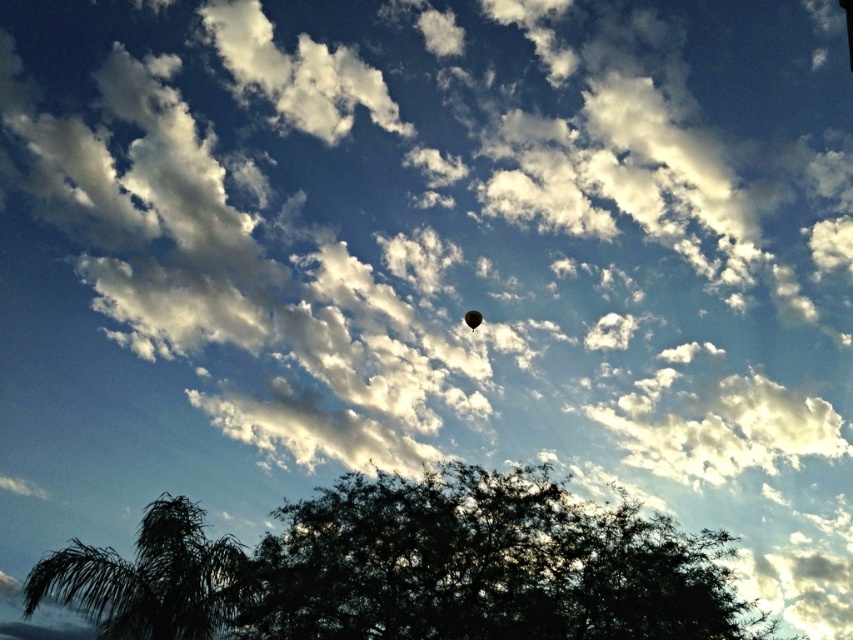
Question: Which of the following is the farthest from the observer?

Choices:
 (A) (473, 323)
 (B) (234, 554)

Answer: (A)

Question: Does dark green leafy tree at center have a lesser width compared to green leafy tree at lower left?

Choices:
 (A) yes
 (B) no

Answer: (B)

Question: Among these points, which one is nearest to the camera?

Choices:
 (A) (144, 540)
 (B) (595, 604)
 (C) (471, 326)

Answer: (B)

Question: Does green leafy tree at lower left have a larger size compared to green rubber balloon at upper center?

Choices:
 (A) yes
 (B) no

Answer: (A)

Question: Among these objects, which one is farthest from the camera?

Choices:
 (A) green rubber balloon at upper center
 (B) dark green leafy tree at center
 (C) green leafy tree at lower left

Answer: (A)

Question: Does dark green leafy tree at center appear under green leafy tree at lower left?

Choices:
 (A) no
 (B) yes

Answer: (A)